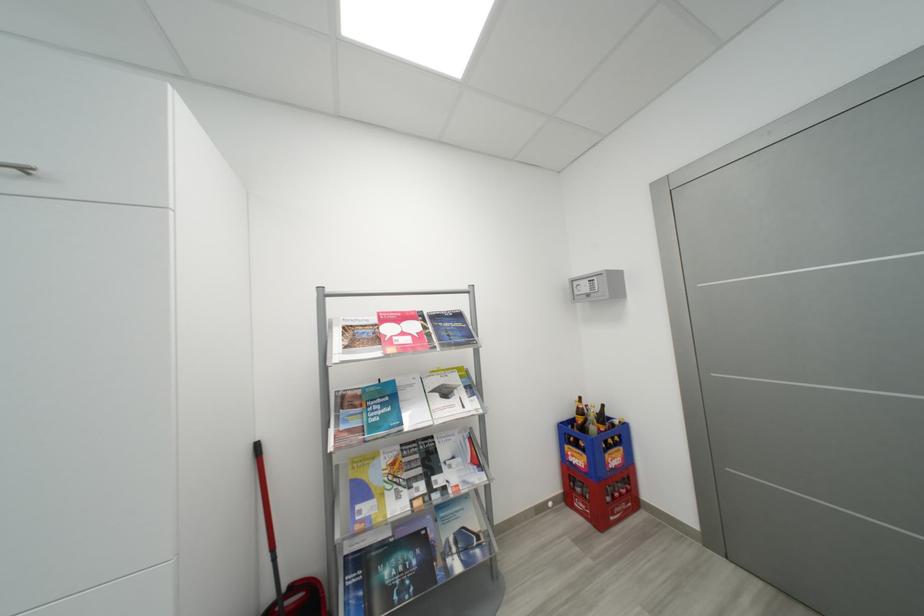
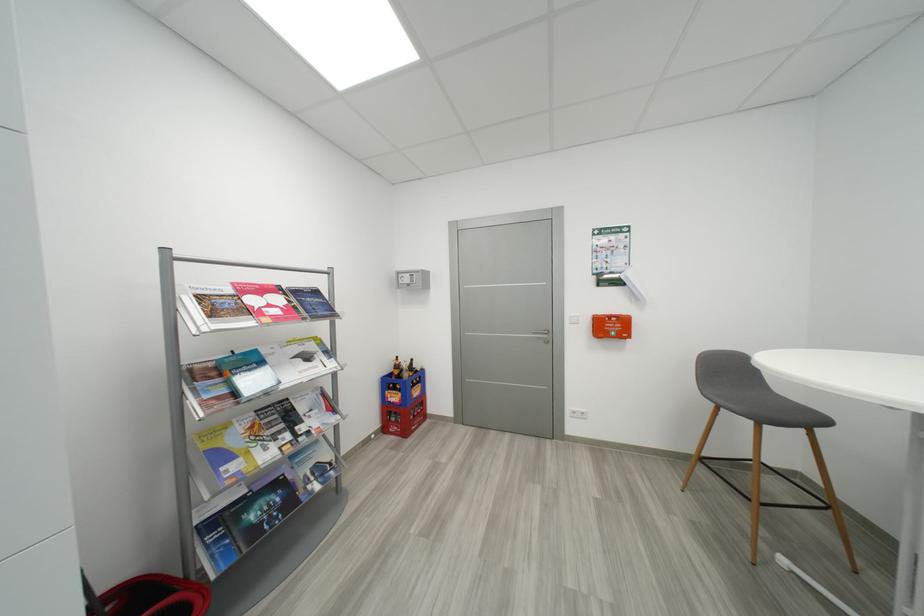
Find the pixel in the second image that matches pixel 426 541 in the first image.

(285, 485)